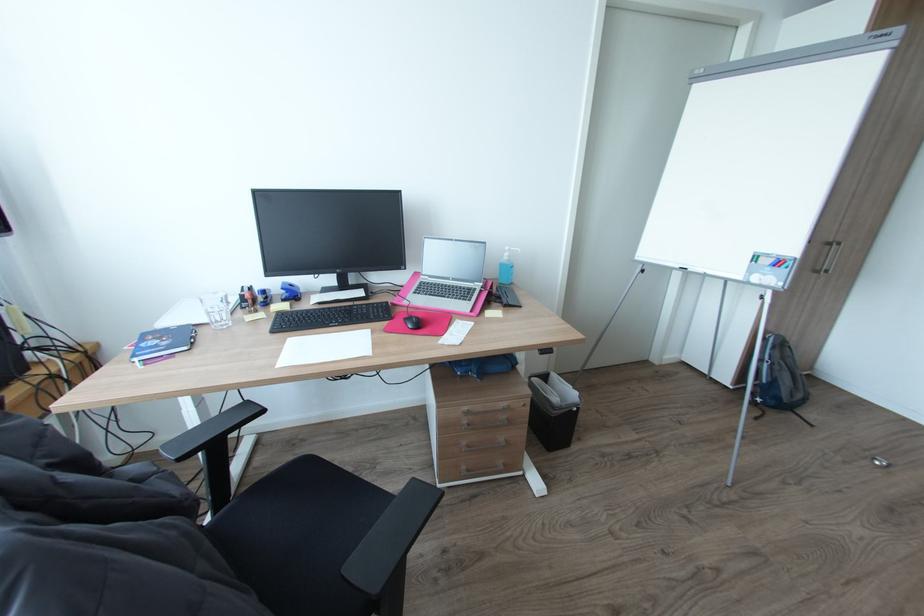
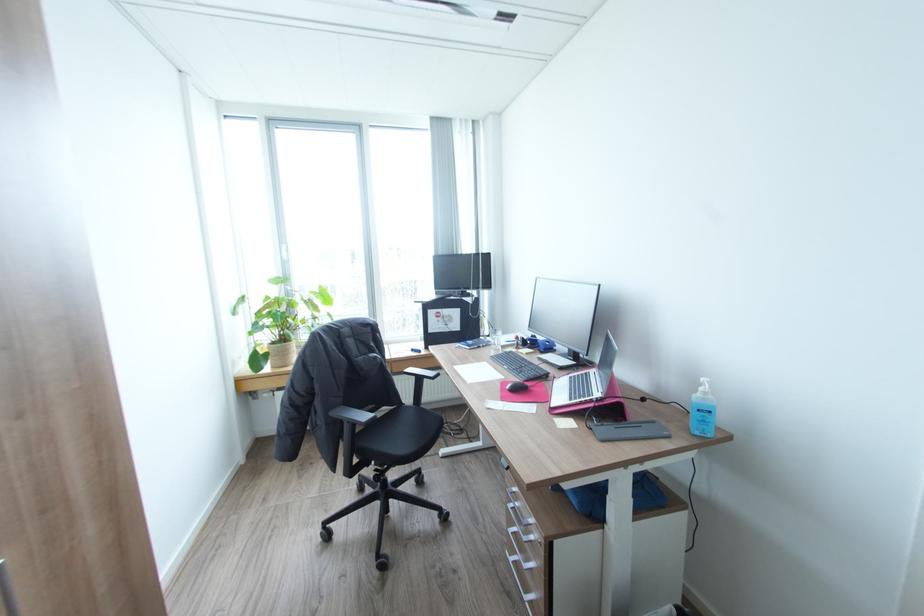
Where in the second image is the point corresponding to [514,256] from the first image?

(710, 392)